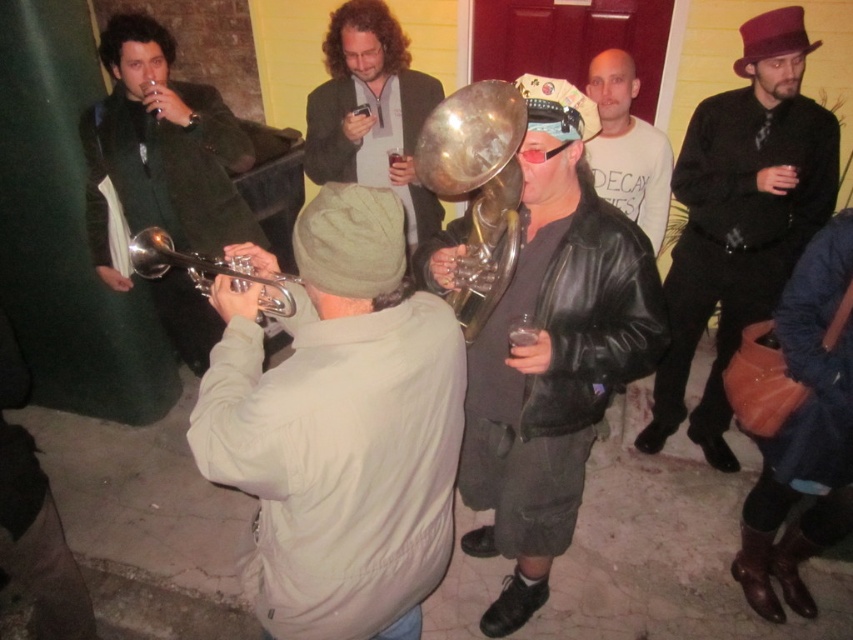
Which of these two, light beige cotton jacket at center or shiny silver trumpet at center, stands shorter?

Standing shorter between the two is shiny silver trumpet at center.

This screenshot has width=853, height=640. Describe the element at coordinates (340, 428) in the screenshot. I see `light beige cotton jacket at center` at that location.

Locate an element on the screen. light beige cotton jacket at center is located at coordinates [x=340, y=428].

Is matte green jacket at left thinner than matte black jacket at center?

No, matte green jacket at left is not thinner than matte black jacket at center.

Does matte green jacket at left come behind matte black jacket at center?

No, it is in front of matte black jacket at center.

Which is in front, point (157, 168) or point (401, 64)?

Point (157, 168) is more forward.

Identify the location of matte green jacket at left. (161, 148).

Measure the distance from shiny brass trumpet at center to white cotton t-shirt at center.

They are 1.37 meters apart.

Is point (473, 138) positioned before point (604, 51)?

Yes, it is.

Is point (500, 163) farther from viewer compared to point (602, 56)?

No.

Locate an element on the screen. shiny brass trumpet at center is located at coordinates (477, 186).